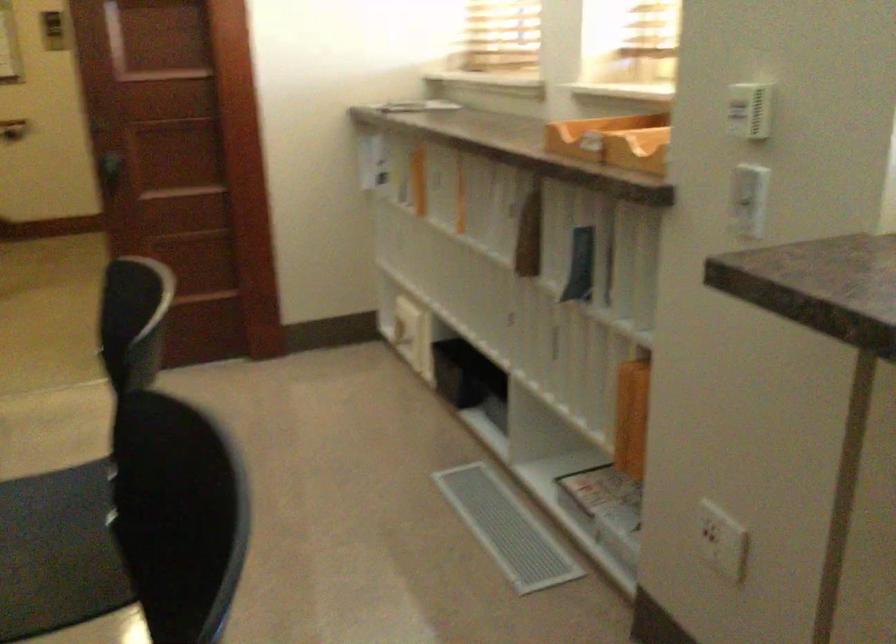
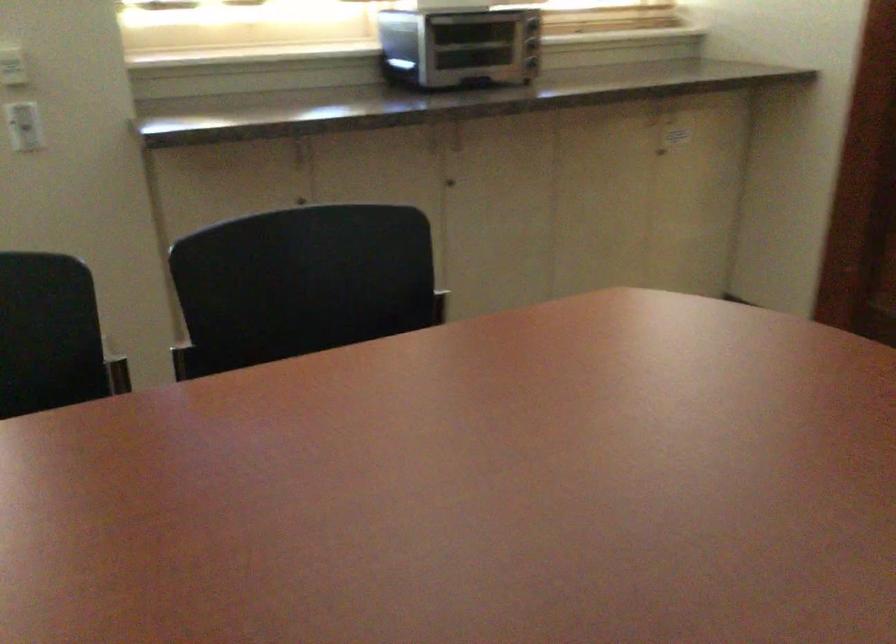
Question: I am providing you with two images of the same scene from different viewpoints. Which of the following objects are not visible in image2?

Choices:
 (A) black and purple shoe
 (B) white power outlet
 (C) toaster oven handle
 (D) small cabinet knob

Answer: (B)